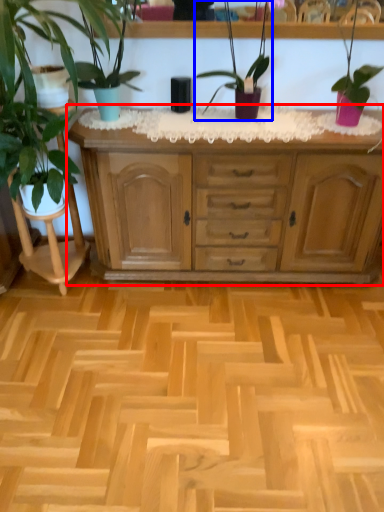
Question: Which point is closer to the camera, chest of drawers (highlighted by a red box) or houseplant (highlighted by a blue box)?

Choices:
 (A) chest of drawers
 (B) houseplant

Answer: (B)